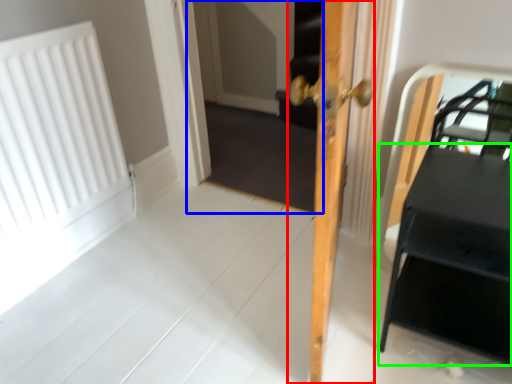
Question: Which object is positioned closest to door (highlighted by a red box)? Select from screen door (highlighted by a blue box) and table (highlighted by a green box).

Choices:
 (A) screen door
 (B) table

Answer: (B)